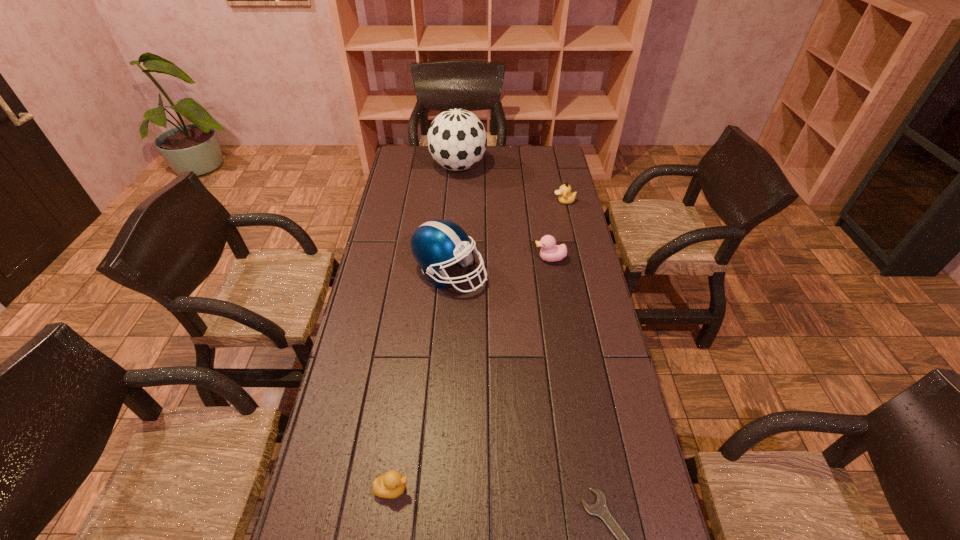
Find the location of a particular element. free point located on the front-facing side of the second nearest duckling is located at coordinates (483, 259).

Locate an element on the screen. The height and width of the screenshot is (540, 960). vacant region located 0.110m on the front-facing side of the second nearest duckling is located at coordinates (504, 259).

In order to click on free space located 0.300m on the face of the fifth nearest object in this screenshot , I will do `click(483, 201)`.

Where is `free space located on the face of the fifth nearest object`? This screenshot has height=540, width=960. free space located on the face of the fifth nearest object is located at coordinates (486, 201).

Identify the location of blank space located 0.240m on the face of the fifth nearest object. The image size is (960, 540). (497, 201).

At what (x,y) coordinates should I click in order to perform the action: click on vacant space located on the face of the leftmost duckling. Please return your answer as a coordinate pair (x, y). The width and height of the screenshot is (960, 540). Looking at the image, I should click on (560, 489).

The image size is (960, 540). What are the coordinates of `object at the far edge` in the screenshot? It's located at (457, 140).

Identify the location of object that is at the left edge. This screenshot has height=540, width=960. [x=392, y=484].

Where is `blank space at the far edge`? blank space at the far edge is located at coordinates (523, 150).

The height and width of the screenshot is (540, 960). Find the location of `blank space at the left edge of the desktop`. blank space at the left edge of the desktop is located at coordinates (356, 364).